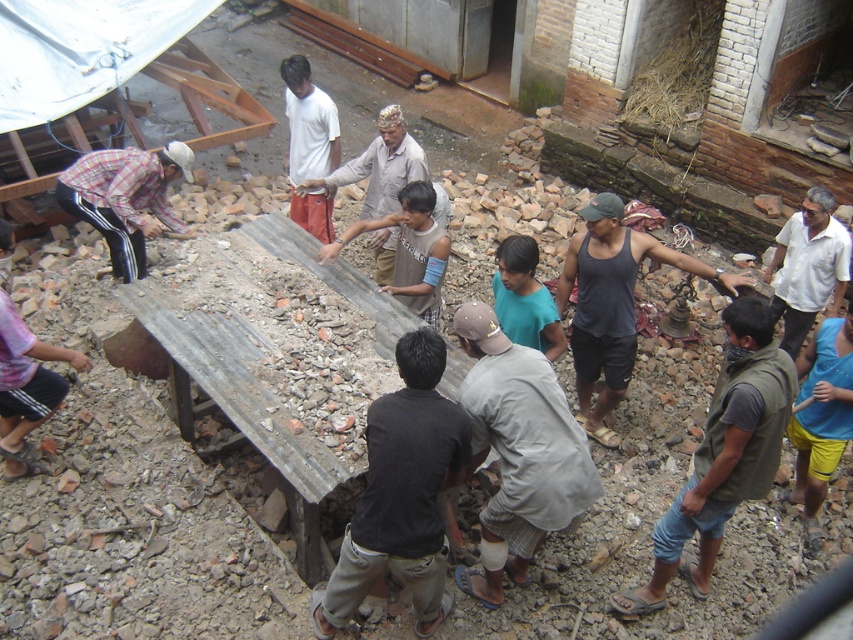
Question: Estimate the real-world distances between objects in this image. Which object is farther from the white cotton shirt at right?

Choices:
 (A) dark gray tank top at center
 (B) light brown fabric shirt at center
 (C) teal fabric shirt at center

Answer: (B)

Question: Which point is farther from the camera taking this photo?

Choices:
 (A) (334, 132)
 (B) (799, 285)
 (C) (599, 403)

Answer: (A)

Question: Does green fabric vest at lower right come in front of white cotton shirt at center?

Choices:
 (A) no
 (B) yes

Answer: (B)

Question: Is white cotton shirt at right smaller than white cotton shirt at center?

Choices:
 (A) no
 (B) yes

Answer: (B)

Question: Which object is farther from the camera taking this photo?

Choices:
 (A) teal fabric shirt at center
 (B) brown fabric shirt at center
 (C) pink fabric shirt at lower left

Answer: (B)

Question: Observing the image, what is the correct spatial positioning of black cotton shirt at center in reference to green fabric vest at lower right?

Choices:
 (A) right
 (B) left

Answer: (B)